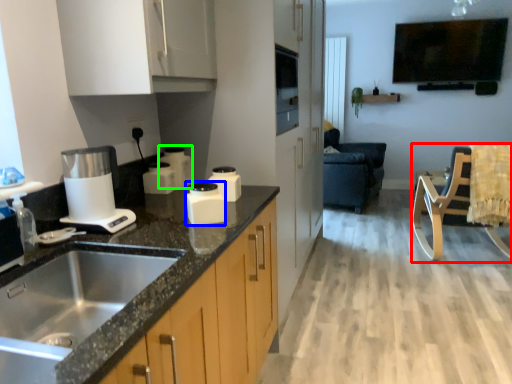
Question: Considering the real-world distances, which object is closest to rocking chair (highlighted by a red box)? kitchen appliance (highlighted by a blue box) or kitchen appliance (highlighted by a green box).

Choices:
 (A) kitchen appliance
 (B) kitchen appliance

Answer: (B)